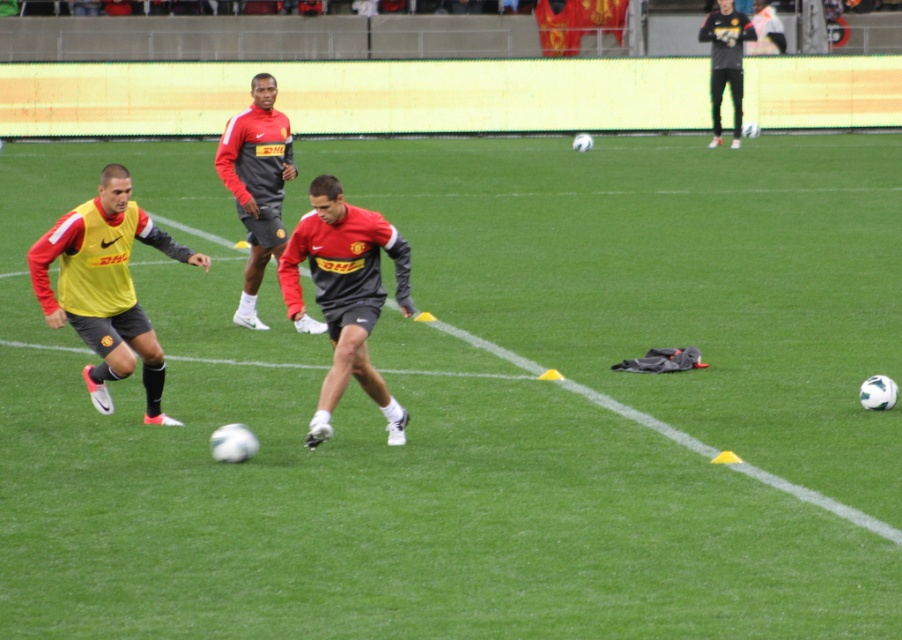
You are a photographer at the soccer training session. You need to capture a closeup shot of the jersey with the Nike swoosh. Which jersey should you focus on, the yellow matte jersey at left or the matte red and black jersey at center?

The matte red and black jersey at center has the Nike swoosh on the shoulders, so you should focus on the matte red and black jersey at center to capture the Nike swoosh closeup.

From the picture: You are a referee observing a soccer training session. You notice two players wearing the yellow matte jersey at left and the matte red and black jersey at center. Which player is taller?

The yellow matte jersey at left is taller than the matte red and black jersey at center.